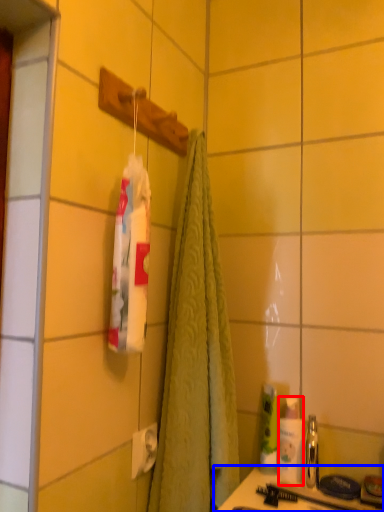
Question: Among these objects, which one is farthest to the camera, toiletry (highlighted by a red box) or counter (highlighted by a blue box)?

Choices:
 (A) toiletry
 (B) counter

Answer: (A)